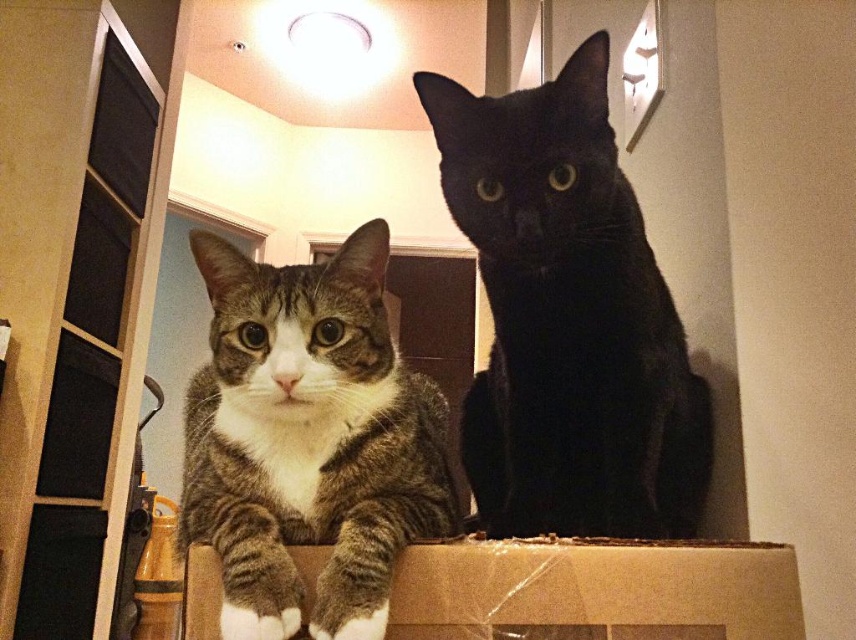
You are a photographer trying to capture the tabby fur cat at center in the image. The camera is positioned at point A, and you need to adjust the focus to ensure the cat is sharp. Given that the focus point is set to point B at coordinates point [308,440], will this point be on the cat?

Yes, the point [308,440] is on the tabby fur cat at center, so adjusting the focus to this point will ensure the cat is in sharp focus.

You are a photographer setting up a shot of the two cats inside the cardboard box. You want to ensure both cats are in focus. Since the black glossy cat at upper center is above the tabby fur cat at center, will adjusting the camera focus on the lower cat first help capture both in the same frame?

Yes, adjusting the camera focus on the tabby fur cat at center first will help capture both cats in focus because the black glossy cat at upper center is positioned above it, so focusing on the lower cat ensures the depth of field includes the upper cat as well.

You are a photographer setting up a shot of the black glossy cat at upper center and the brown cardboard box at center. You want to ensure the cat is in focus while the box is slightly blurred. Which part of the image should you adjust the camera focus on?

You should focus on the black glossy cat at upper center since it is above the brown cardboard box at center, making it the primary subject to be in focus while the box can remain slightly blurred.